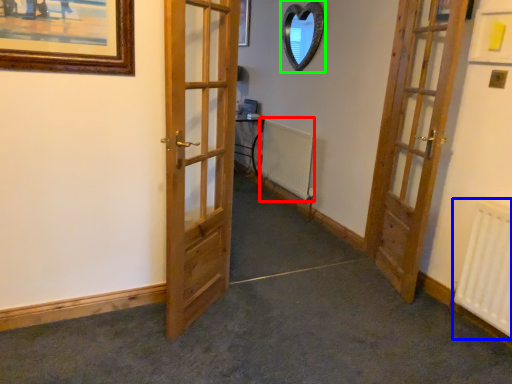
Question: Which object is the farthest from radiator (highlighted by a red box)? Choose among these: radiator (highlighted by a blue box) or mirror (highlighted by a green box).

Choices:
 (A) radiator
 (B) mirror

Answer: (A)